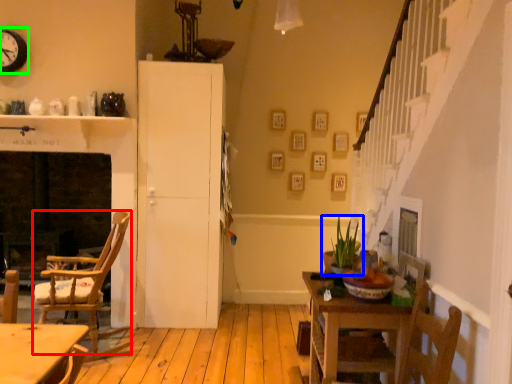
Question: Estimate the real-world distances between objects in this image. Which object is closer to chair (highlighted by a red box), houseplant (highlighted by a blue box) or clock (highlighted by a green box)?

Choices:
 (A) houseplant
 (B) clock

Answer: (B)